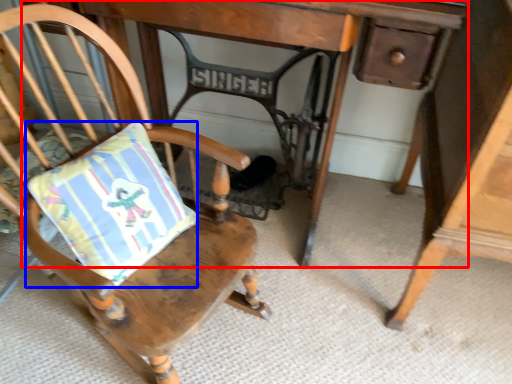
Question: Which object appears closest to the camera in this image, table (highlighted by a red box) or pillow (highlighted by a blue box)?

Choices:
 (A) table
 (B) pillow

Answer: (B)